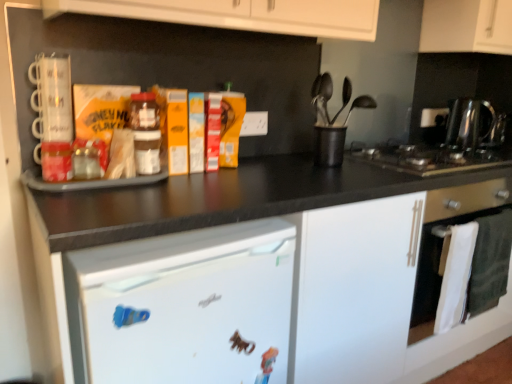
Question: Considering the positions of white glossy oven at lower right and black plastic utensil holder at center in the image, is white glossy oven at lower right wider or thinner than black plastic utensil holder at center?

Choices:
 (A) wide
 (B) thin

Answer: (B)

Question: In the image, is white glossy oven at lower right on the left side or the right side of black plastic utensil holder at center?

Choices:
 (A) right
 (B) left

Answer: (A)

Question: Estimate the real-world distances between objects in this image. Which object is farther from the polished stainless steel kettle at right?

Choices:
 (A) white matte cabinet at upper right
 (B) black plastic utensil holder at center
 (C) white matte refrigerator at lower left
 (D) white glossy oven at lower right
 (E) translucent plastic jar at center

Answer: (E)

Question: Estimate the real-world distances between objects in this image. Which object is farther from the white matte refrigerator at lower left?

Choices:
 (A) translucent plastic jar at center
 (B) white matte cabinet at upper right
 (C) polished stainless steel kettle at right
 (D) black plastic utensil holder at center
 (E) black stainless steel gas stove at right

Answer: (B)